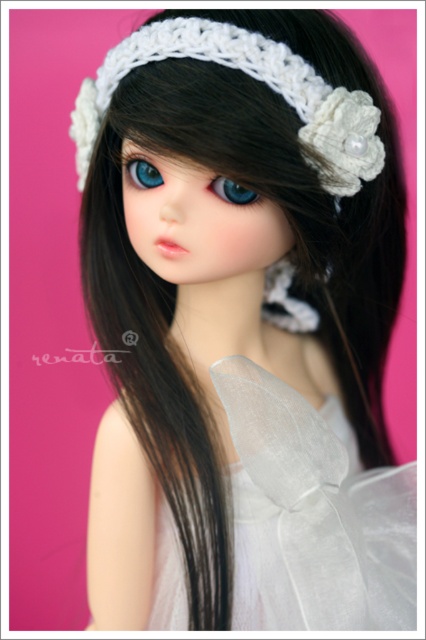
Looking at this image, does blue glossy eye at center have a larger size compared to blue glossy eye at upper center?

Incorrect, blue glossy eye at center is not larger than blue glossy eye at upper center.

Which of these two, blue glossy eye at center or blue glossy eye at upper center, stands shorter?

blue glossy eye at center

Who is more distant from viewer, (227, 200) or (143, 161)?

Point (143, 161)

Locate an element on the screen. The image size is (426, 640). blue glossy eye at center is located at coordinates (232, 192).

Can you confirm if white crochet headband at upper center is shorter than blue glossy eye at upper center?

No.

At what (x,y) coordinates should I click in order to perform the action: click on white crochet headband at upper center. Please return your answer as a coordinate pair (x, y). Looking at the image, I should click on (255, 77).

Can you confirm if white crochet headband at upper center is smaller than blue glossy eye at center?

Incorrect, white crochet headband at upper center is not smaller in size than blue glossy eye at center.

Based on the photo, which is above, white crochet headband at upper center or blue glossy eye at center?

white crochet headband at upper center

Find the location of `white crochet headband at upper center`. white crochet headband at upper center is located at coordinates (255, 77).